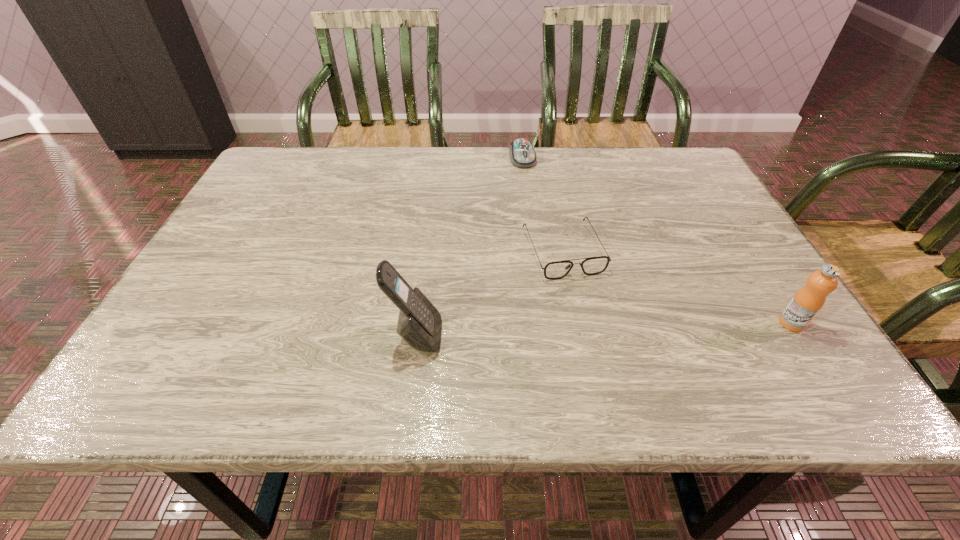
Find the location of a particular element. The width and height of the screenshot is (960, 540). free space between the farthest object and the tallest object is located at coordinates (469, 247).

I want to click on free space between the computer mouse and the third shortest object, so click(657, 241).

Find the location of a particular element. The height and width of the screenshot is (540, 960). free spot between the sunglasses and the orange juice is located at coordinates (677, 287).

The image size is (960, 540). Identify the location of free space between the shortest object and the orange juice. (657, 241).

I want to click on free space between the orange juice and the shortest object, so click(657, 241).

Identify which object is located as the second nearest to the tallest object. Please provide its 2D coordinates. Your answer should be formatted as a tuple, i.e. [(x, y)], where the tuple contains the x and y coordinates of a point satisfying the conditions above.

[(522, 154)]

Identify which object is the closest to the orange juice. Please provide its 2D coordinates. Your answer should be formatted as a tuple, i.e. [(x, y)], where the tuple contains the x and y coordinates of a point satisfying the conditions above.

[(594, 265)]